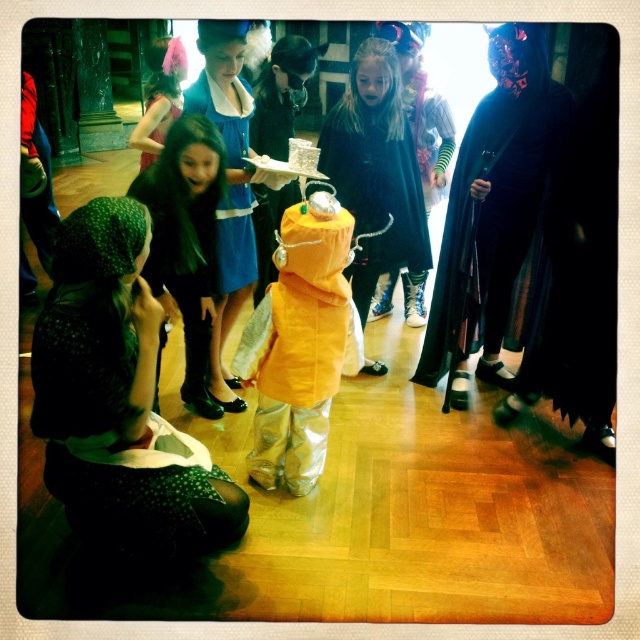
You are attending a costume party and notice two dresses in the room. The green dotted dress at lower left and the matte pink dress at upper left. Which dress is bigger?

The green dotted dress at lower left is larger in size than the matte pink dress at upper left.

You are organizing a fashion show and need to arrange the velvet blue dress at center and the matte pink dress at upper left on a stage. Which dress should be placed first if you want to prioritize the one that takes up more space?

The matte pink dress at upper left should be placed first because it occupies more space than the velvet blue dress at center.